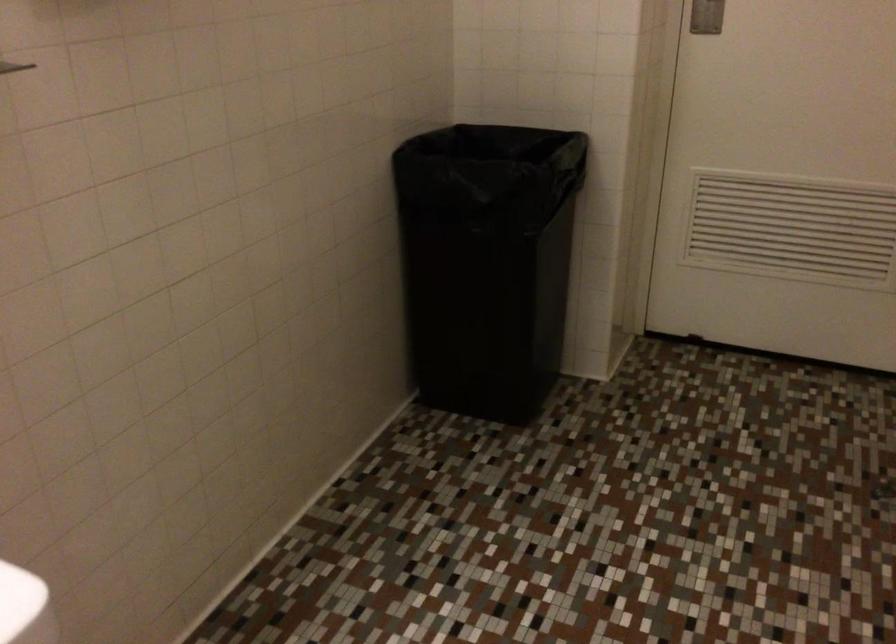
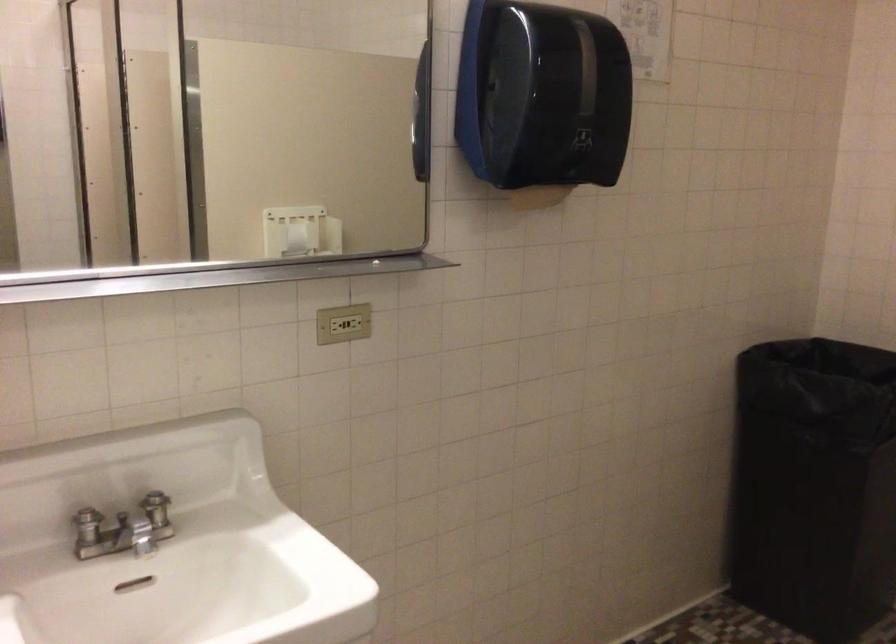
The point at (485, 283) is marked in the first image. Where is the corresponding point in the second image?

(814, 486)